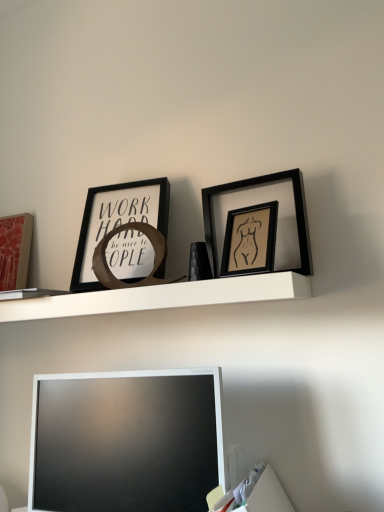
Question: Is matte pink picture frame at left, which is counted as the first picture frame, starting from the left, far away from white glossy television at lower center?

Choices:
 (A) no
 (B) yes

Answer: (A)

Question: Does matte pink picture frame at left, which is counted as the first picture frame, starting from the left, have a lesser width compared to white glossy television at lower center?

Choices:
 (A) no
 (B) yes

Answer: (B)

Question: Is matte pink picture frame at left, which ranks as the fourth picture frame in right-to-left order, closer to the viewer compared to white glossy television at lower center?

Choices:
 (A) no
 (B) yes

Answer: (A)

Question: Is the surface of matte pink picture frame at left, which ranks as the fourth picture frame in right-to-left order, in direct contact with white glossy television at lower center?

Choices:
 (A) yes
 (B) no

Answer: (B)

Question: Is matte pink picture frame at left, which is counted as the first picture frame, starting from the left, at the left side of white glossy television at lower center?

Choices:
 (A) yes
 (B) no

Answer: (A)

Question: In terms of width, does matte black picture frame at upper left, the 2th picture frame from the back, look wider or thinner when compared to black matte picture frame at upper right, positioned as the first picture frame in right-to-left order?

Choices:
 (A) thin
 (B) wide

Answer: (B)

Question: Is matte black picture frame at upper left, which is the second picture frame from left to right, inside the boundaries of black matte picture frame at upper right, which ranks as the 3th picture frame in back-to-front order, or outside?

Choices:
 (A) outside
 (B) inside

Answer: (A)

Question: From a real-world perspective, is matte black picture frame at upper left, which is the 3th picture frame in front-to-back order, positioned above or below black matte picture frame at upper right, placed as the 4th picture frame when sorted from left to right?

Choices:
 (A) above
 (B) below

Answer: (A)

Question: From the image's perspective, is matte black picture frame at upper left, placed as the 3th picture frame when sorted from right to left, positioned above or below black matte picture frame at upper right, acting as the 2th picture frame starting from the front?

Choices:
 (A) below
 (B) above

Answer: (A)

Question: In the image, is white glossy television at lower center positioned in front of or behind black matte picture frame at upper right, positioned as the first picture frame in right-to-left order?

Choices:
 (A) behind
 (B) front

Answer: (B)

Question: Visually, is white glossy television at lower center positioned to the left or to the right of black matte picture frame at upper right, placed as the 4th picture frame when sorted from left to right?

Choices:
 (A) right
 (B) left

Answer: (B)

Question: In terms of height, does white glossy television at lower center look taller or shorter compared to black matte picture frame at upper right, placed as the 4th picture frame when sorted from left to right?

Choices:
 (A) short
 (B) tall

Answer: (B)

Question: From a real-world perspective, is white glossy television at lower center positioned above or below black matte picture frame at upper right, placed as the 4th picture frame when sorted from left to right?

Choices:
 (A) below
 (B) above

Answer: (A)

Question: Based on their positions, is matte pink picture frame at left, which ranks as the fourth picture frame in right-to-left order, located to the left or right of white matte shelf at upper center?

Choices:
 (A) right
 (B) left

Answer: (B)

Question: Is matte pink picture frame at left, the 1th picture frame viewed from the back, wider or thinner than white matte shelf at upper center?

Choices:
 (A) thin
 (B) wide

Answer: (A)